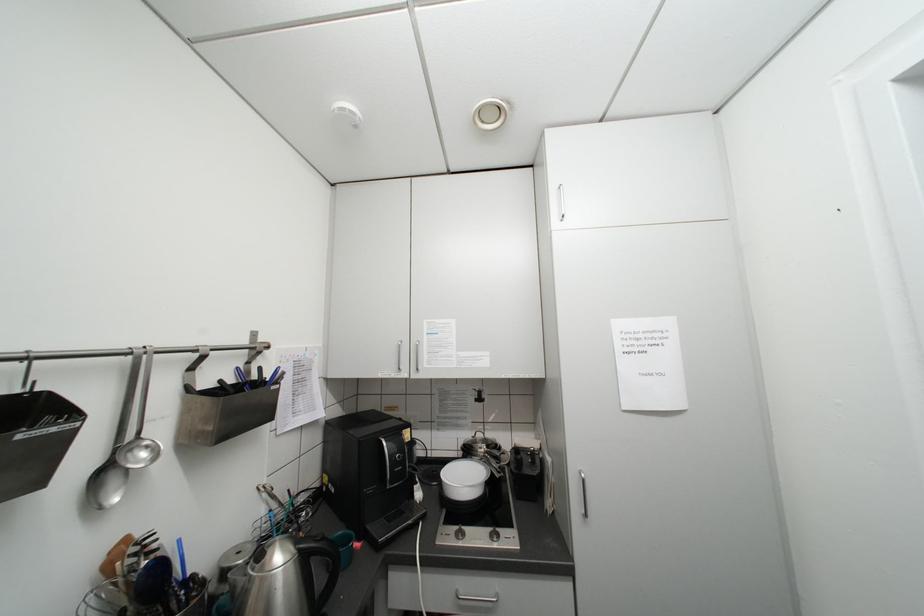
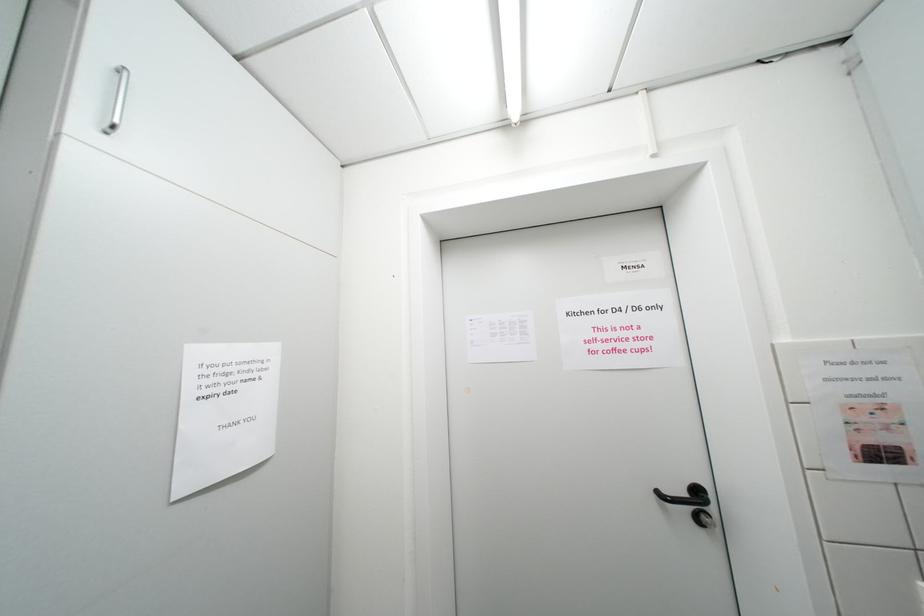
Question: How did the camera likely rotate?

Choices:
 (A) Left
 (B) Right
 (C) Up
 (D) Down

Answer: (B)